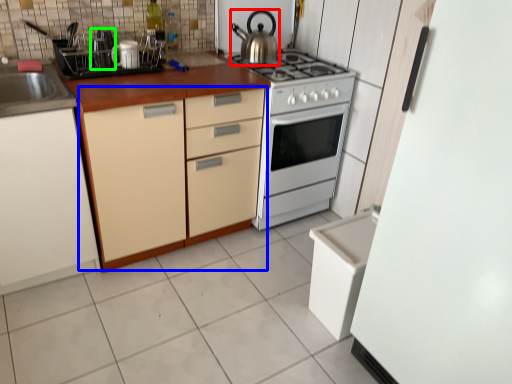
Question: Estimate the real-world distances between objects in this image. Which object is closer to kitchen appliance (highlighted by a red box), cabinetry (highlighted by a blue box) or appliance (highlighted by a green box)?

Choices:
 (A) cabinetry
 (B) appliance

Answer: (A)